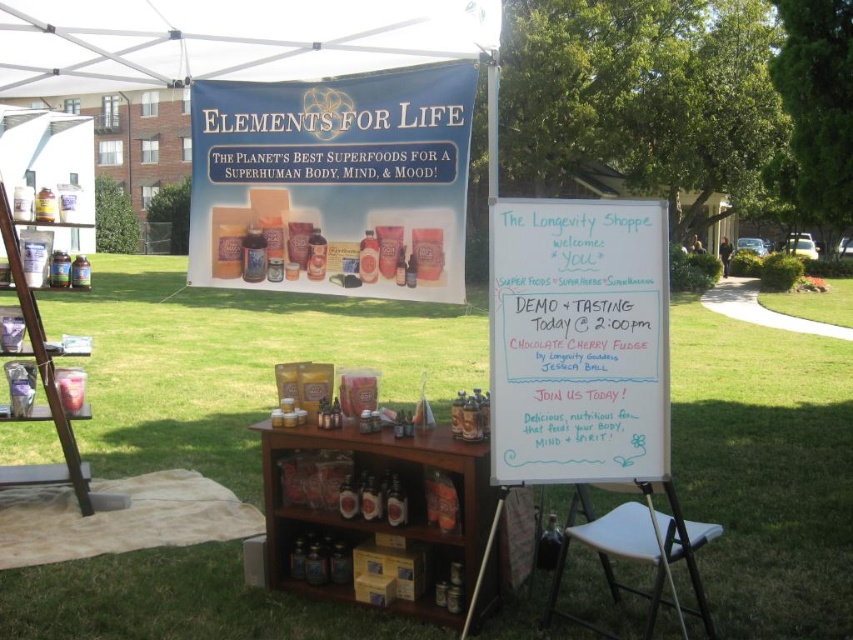
Does blue fabric banner at upper center have a smaller size compared to white chalkboard at center?

Incorrect, blue fabric banner at upper center is not smaller in size than white chalkboard at center.

Which of these two, blue fabric banner at upper center or white chalkboard at center, stands shorter?

white chalkboard at center is shorter.

Does point (477, 72) come farther from viewer compared to point (641, 360)?

Yes.

The width and height of the screenshot is (853, 640). I want to click on blue fabric banner at upper center, so click(334, 182).

The width and height of the screenshot is (853, 640). What are the coordinates of `green grass at lower center` in the screenshot? It's located at (236, 362).

Can you confirm if green grass at lower center is taller than white plastic stool at lower center?

Yes.

Find the location of `green grass at lower center`. green grass at lower center is located at coordinates (236, 362).

Which is below, blue fabric banner at upper center or white fabric canopy at upper center?

Positioned lower is blue fabric banner at upper center.

Does blue fabric banner at upper center lie in front of white fabric canopy at upper center?

No, it is behind white fabric canopy at upper center.

Is point (329, 164) closer to camera compared to point (337, 19)?

That is False.

The width and height of the screenshot is (853, 640). Find the location of `blue fabric banner at upper center`. blue fabric banner at upper center is located at coordinates (334, 182).